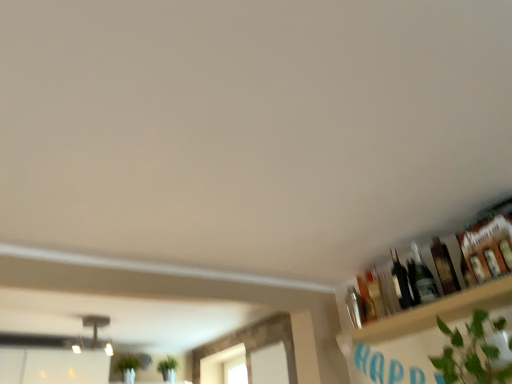
Question: Considering the relative sizes of wooden shelf at upper right and translucent glass bottle at upper right, acting as the 2th bottle starting from the right, in the image provided, is wooden shelf at upper right wider than translucent glass bottle at upper right, acting as the 2th bottle starting from the right,?

Choices:
 (A) yes
 (B) no

Answer: (A)

Question: Is wooden shelf at upper right to the right of translucent glass bottle at upper right, positioned as the 3th bottle in left-to-right order, from the viewer's perspective?

Choices:
 (A) yes
 (B) no

Answer: (A)

Question: Is translucent glass bottle at upper right, acting as the 2th bottle starting from the right, completely or partially inside wooden shelf at upper right?

Choices:
 (A) yes
 (B) no

Answer: (B)

Question: From the image's perspective, is wooden shelf at upper right under translucent glass bottle at upper right, positioned as the 3th bottle in left-to-right order?

Choices:
 (A) no
 (B) yes

Answer: (B)

Question: Is wooden shelf at upper right looking in the opposite direction of translucent glass bottle at upper right, positioned as the 3th bottle in left-to-right order?

Choices:
 (A) yes
 (B) no

Answer: (B)

Question: Looking at their shapes, would you say wooden shelf at upper right is wider or thinner than translucent glass bottle at upper right, which ranks as the fourth bottle in left-to-right order?

Choices:
 (A) thin
 (B) wide

Answer: (B)

Question: In terms of height, does wooden shelf at upper right look taller or shorter compared to translucent glass bottle at upper right, which ranks as the first bottle in right-to-left order?

Choices:
 (A) tall
 (B) short

Answer: (B)

Question: From a real-world perspective, is wooden shelf at upper right positioned above or below translucent glass bottle at upper right, which ranks as the first bottle in right-to-left order?

Choices:
 (A) below
 (B) above

Answer: (A)

Question: Visually, is wooden shelf at upper right positioned to the left or to the right of translucent glass bottle at upper right, which ranks as the first bottle in right-to-left order?

Choices:
 (A) right
 (B) left

Answer: (B)

Question: Visually, is translucent glass bottle at upper right, acting as the 2th bottle starting from the right, positioned to the left or to the right of wooden shelf at upper right?

Choices:
 (A) right
 (B) left

Answer: (B)

Question: From a real-world perspective, is translucent glass bottle at upper right, positioned as the 3th bottle in left-to-right order, physically located above or below wooden shelf at upper right?

Choices:
 (A) above
 (B) below

Answer: (A)

Question: In terms of height, does translucent glass bottle at upper right, positioned as the 3th bottle in left-to-right order, look taller or shorter compared to wooden shelf at upper right?

Choices:
 (A) tall
 (B) short

Answer: (A)

Question: In terms of width, does translucent glass bottle at upper right, acting as the 2th bottle starting from the right, look wider or thinner when compared to wooden shelf at upper right?

Choices:
 (A) wide
 (B) thin

Answer: (B)

Question: Based on their positions, is shiny dark glass bottle at upper right, which is counted as the third bottle, starting from the right, located to the left or right of green leafy plant at lower right?

Choices:
 (A) left
 (B) right

Answer: (A)

Question: Does point (404, 271) appear closer or farther from the camera than point (454, 360)?

Choices:
 (A) farther
 (B) closer

Answer: (A)